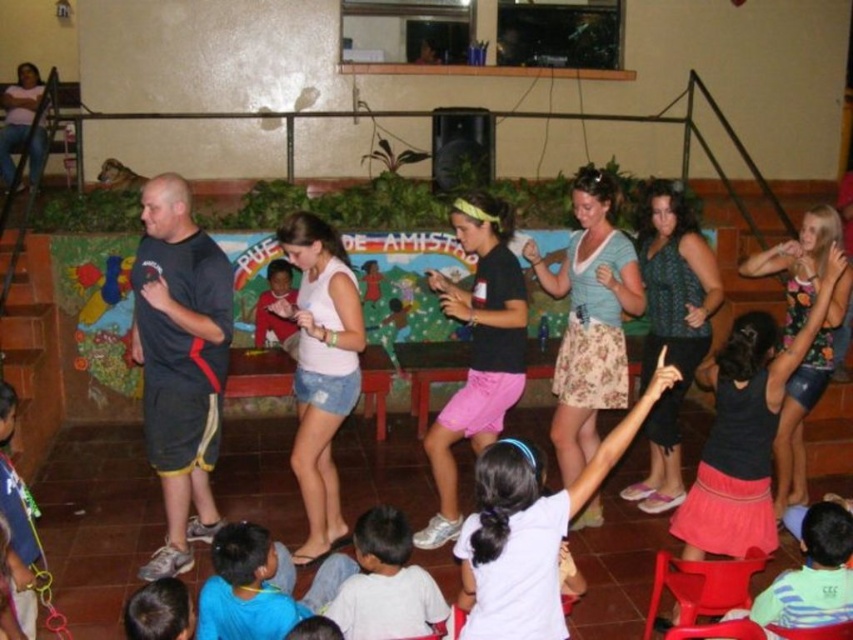
Question: Is black fabric shirt at center further to the viewer compared to white cotton shirt at lower center?

Choices:
 (A) no
 (B) yes

Answer: (B)

Question: Can you confirm if white cotton shirt at lower center is wider than light blue t-shirt at center?

Choices:
 (A) no
 (B) yes

Answer: (B)

Question: Which object is positioned closest to the light blue t-shirt at center?

Choices:
 (A) black fabric shirt at center
 (B) white cotton shirt at lower center

Answer: (B)

Question: Which of the following is the farthest from the observer?

Choices:
 (A) (401, 536)
 (B) (811, 548)
 (C) (165, 289)

Answer: (C)

Question: Does black fabric shirt at center appear over white cotton shirt at lower center?

Choices:
 (A) yes
 (B) no

Answer: (A)

Question: Which point is closer to the camera taking this photo?

Choices:
 (A) (834, 515)
 (B) (426, 620)

Answer: (A)